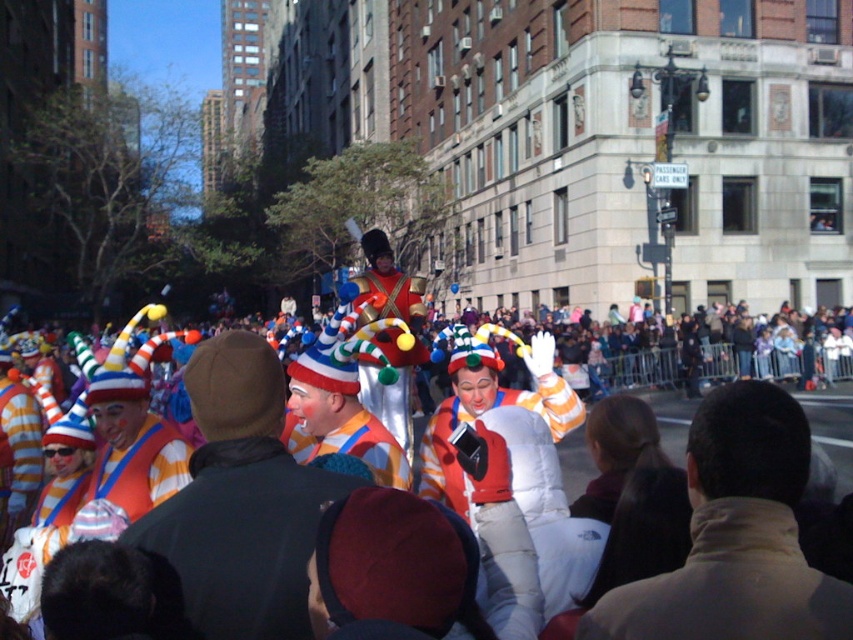
Between matte white balloon at center and matte clown costume at center, which one appears on the left side from the viewer's perspective?

Positioned to the left is matte clown costume at center.

Between matte white balloon at center and matte clown costume at center, which one has more height?

matte white balloon at center is taller.

The height and width of the screenshot is (640, 853). What do you see at coordinates (517, 456) in the screenshot? I see `matte white balloon at center` at bounding box center [517, 456].

You are a GUI agent. You are given a task and a screenshot of the screen. Output one action in this format:
    pyautogui.click(x=<x>, y=<y>)
    Task: Click on the matte white balloon at center
    This screenshot has height=640, width=853.
    Given the screenshot: What is the action you would take?
    pyautogui.click(x=517, y=456)

Which of these two, matte white clown at center or matte clown costume at center, stands taller?

With more height is matte white clown at center.

Is point (154, 560) behind point (390, 465)?

No, (154, 560) is closer to viewer.

Locate an element on the screen. The height and width of the screenshot is (640, 853). matte white clown at center is located at coordinates (236, 506).

I want to click on matte white clown at center, so click(x=236, y=506).

Does matte clown costume at center come behind matte orange and white striped costume at center?

No, it is in front of matte orange and white striped costume at center.

Based on the photo, between matte clown costume at center and matte orange and white striped costume at center, which one has less height?

Standing shorter between the two is matte orange and white striped costume at center.

I want to click on matte clown costume at center, so click(341, 406).